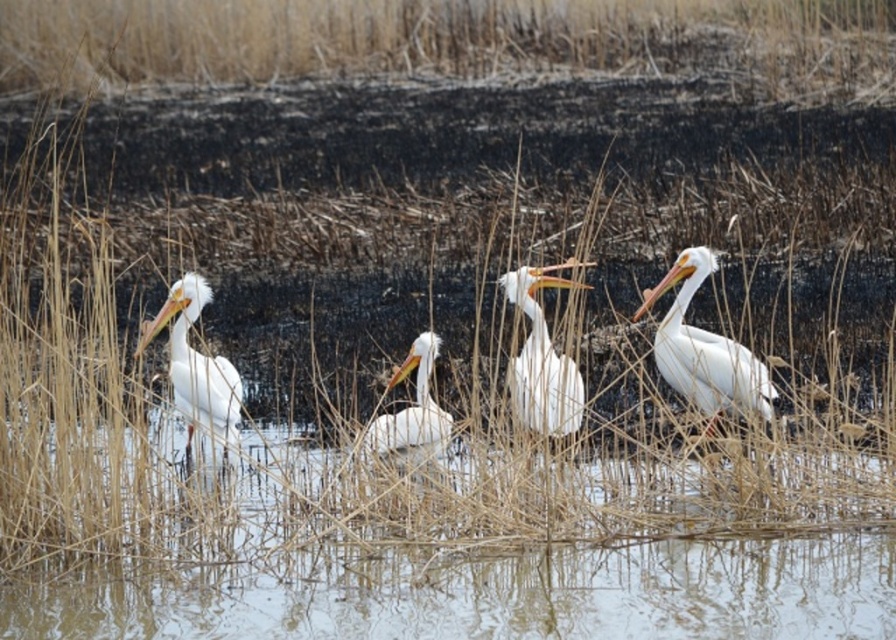
You are a photographer trying to capture a reflection of the clear water at lower center. Based on the scene description, where should you position your camera to ensure the reflection is visible?

The clear water at lower center is located at point (490, 595), so you should position your camera at that coordinate to capture its reflection.

You are a wildlife photographer trying to capture a photo of the white smooth pelican at center and the white matte pelican at left. Which pelican has a narrower body?

The white smooth pelican at center has a narrower body than the white matte pelican at left.

You are a birdwatcher observing the white matte pelican at left and the white matte pelican at center. Which pelican is positioned further to the left?

The white matte pelican at left is positioned further to the left than the white matte pelican at center.